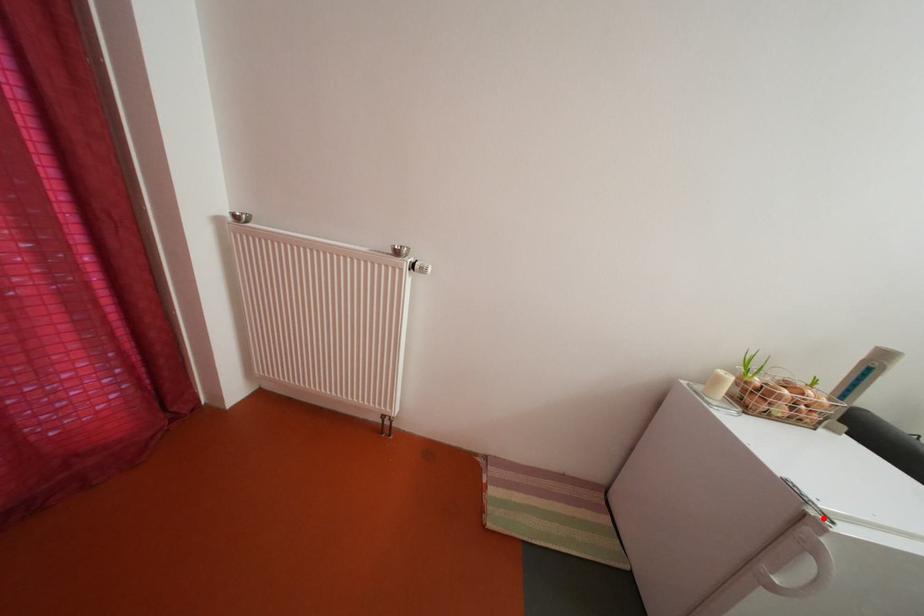
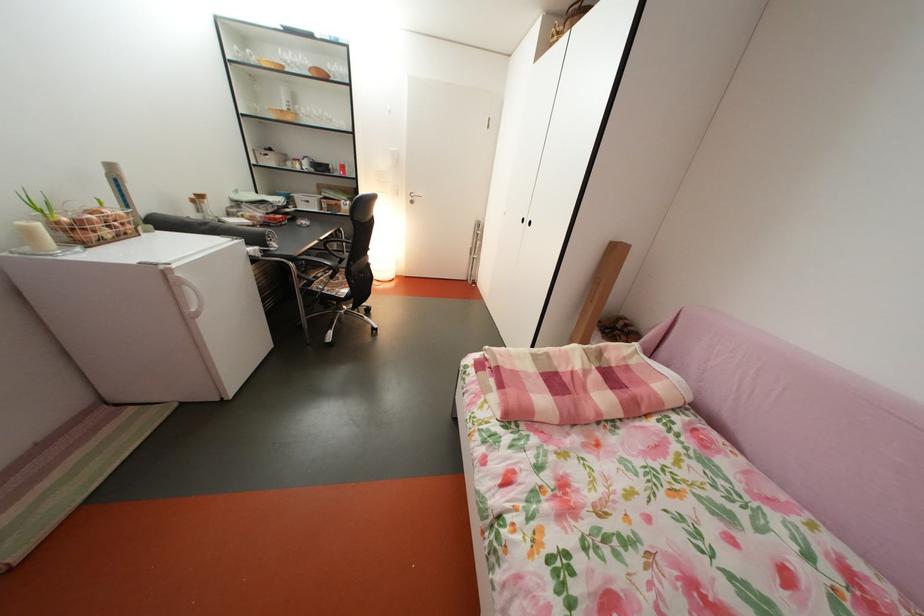
Question: I am providing you with two images of the same scene from different viewpoints. Given a red point in image1, look at the same physical point in image2. Is it:

Choices:
 (A) Closer to the viewpoint
 (B) Farther from the viewpoint

Answer: (B)